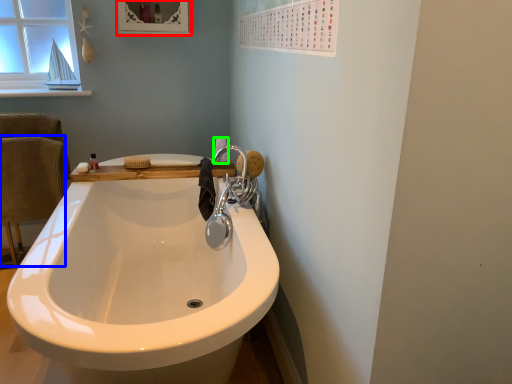
Question: Estimate the real-world distances between objects in this image. Which object is closer to medicine cabinet (highlighted by a red box), armchair (highlighted by a blue box) or toilet paper (highlighted by a green box)?

Choices:
 (A) armchair
 (B) toilet paper

Answer: (B)